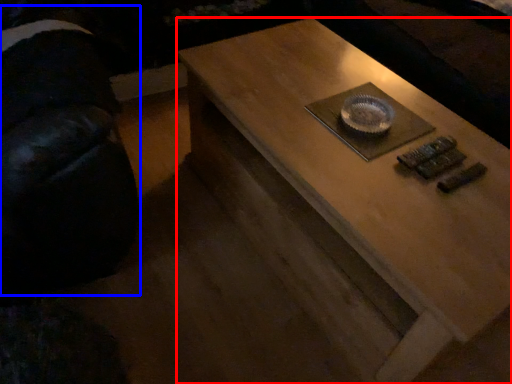
Question: Which point is further to the camera, coffee table (highlighted by a red box) or swivel chair (highlighted by a blue box)?

Choices:
 (A) coffee table
 (B) swivel chair

Answer: (A)